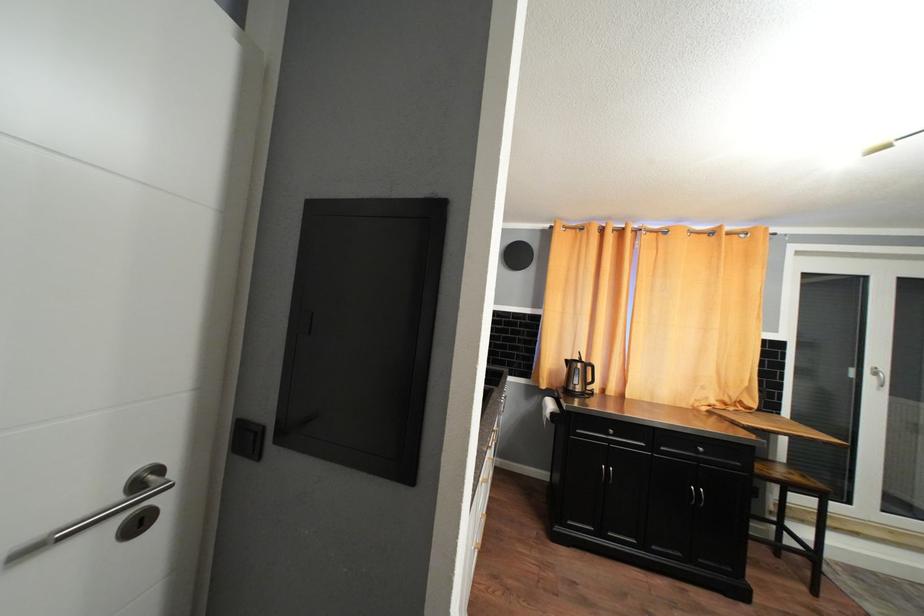
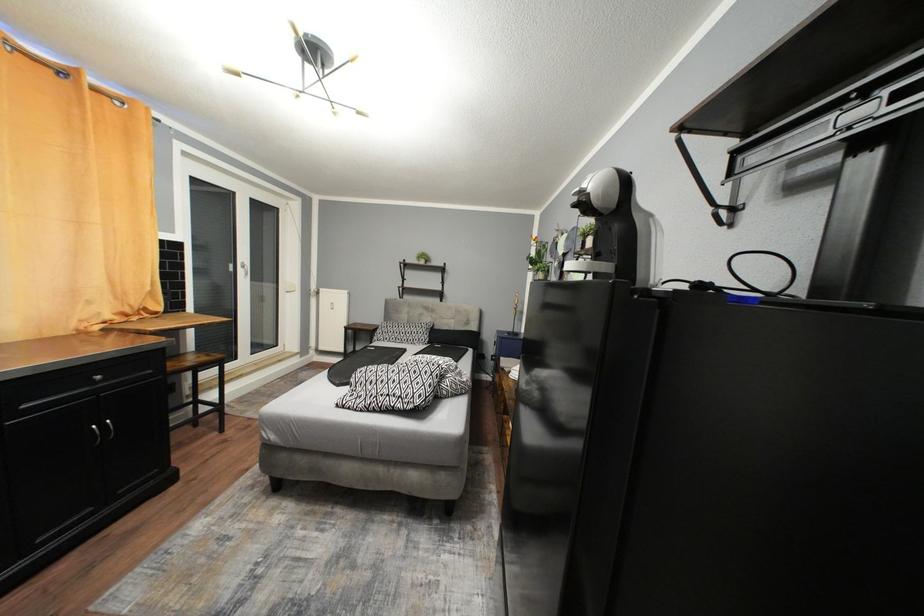
Question: Based on the continuous images, in which direction is the camera rotating? Reply with the corresponding letter.

Choices:
 (A) Left
 (B) Right
 (C) Up
 (D) Down

Answer: (B)